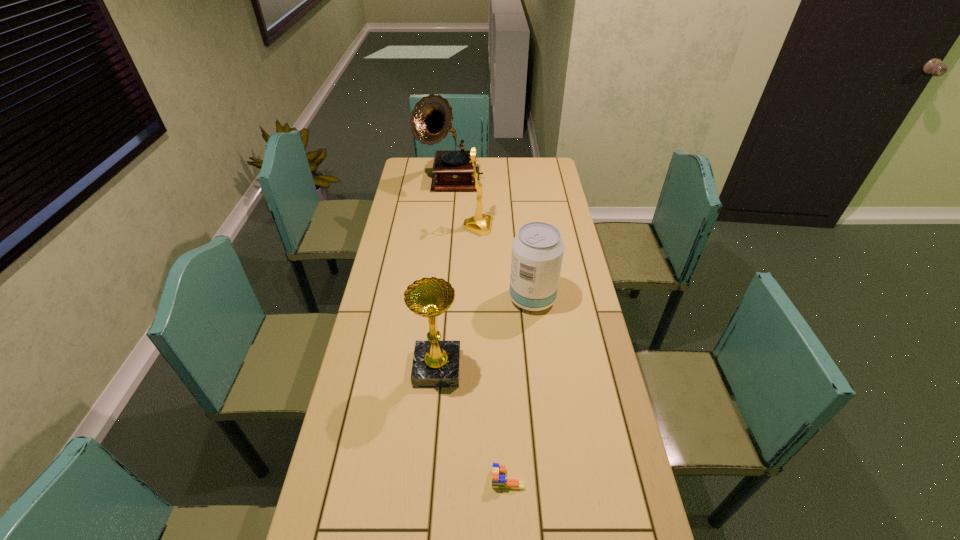
At what (x,y) coordinates should I click in order to perform the action: click on record player. Please return your answer as a coordinate pair (x, y). Image resolution: width=960 pixels, height=540 pixels. Looking at the image, I should click on (431, 119).

You are a GUI agent. You are given a task and a screenshot of the screen. Output one action in this format:
    pyautogui.click(x=<x>, y=<y>)
    Task: Click on the tallest object
    This screenshot has height=540, width=960.
    Given the screenshot: What is the action you would take?
    pyautogui.click(x=431, y=119)

Where is `the fourth nearest object`? Image resolution: width=960 pixels, height=540 pixels. the fourth nearest object is located at coordinates (480, 224).

Identify the location of the fourth farthest object. The height and width of the screenshot is (540, 960). (436, 363).

The image size is (960, 540). In order to click on the third nearest object in this screenshot , I will do `click(537, 250)`.

Find the location of a particular element. This screenshot has width=960, height=540. the nearest object is located at coordinates (499, 480).

At what (x,y) coordinates should I click in order to perform the action: click on Lego. Please return your answer as a coordinate pair (x, y). The image size is (960, 540). Looking at the image, I should click on (499, 480).

Find the location of a particular element. This screenshot has width=960, height=540. vacant point located on the horn of the tallest object is located at coordinates (444, 252).

Locate an element on the screen. vacant region located 0.170m on the front-facing side of the farther award is located at coordinates click(x=532, y=227).

This screenshot has height=540, width=960. Find the location of `vacant space located 0.130m on the front-facing side of the nearer award`. vacant space located 0.130m on the front-facing side of the nearer award is located at coordinates (502, 368).